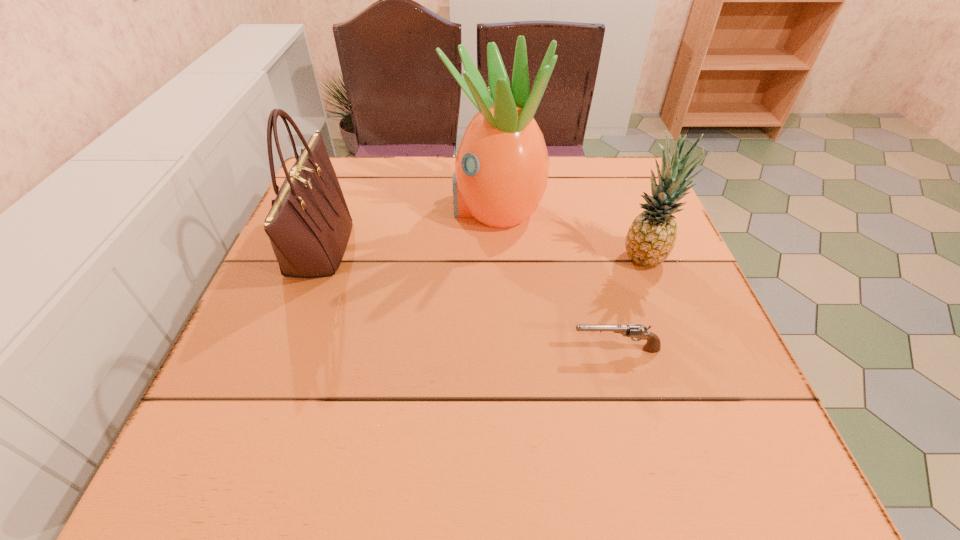
In the image, there is a desktop. Identify the location of vacant region at the far edge. (429, 160).

This screenshot has width=960, height=540. In the image, there is a desktop. In order to click on vacant space at the near edge in this screenshot , I will do `click(354, 474)`.

Locate an element on the screen. The width and height of the screenshot is (960, 540). vacant region at the left edge is located at coordinates (319, 292).

In the image, there is a desktop. What are the coordinates of `vacant space at the right edge` in the screenshot? It's located at (690, 376).

You are a GUI agent. You are given a task and a screenshot of the screen. Output one action in this format:
    pyautogui.click(x=<x>, y=<y>)
    Task: Click on the vacant point at the far left corner
    The height and width of the screenshot is (540, 960).
    Given the screenshot: What is the action you would take?
    pyautogui.click(x=331, y=158)

The image size is (960, 540). In the image, there is a desktop. What are the coordinates of `blank space at the far right corner` in the screenshot? It's located at (605, 202).

The width and height of the screenshot is (960, 540). I want to click on vacant space at the near right corner of the desktop, so pyautogui.click(x=764, y=451).

Find the location of a particular element. The image size is (960, 540). vacant space that's between the leftmost object and the shorter pineapple is located at coordinates (482, 252).

Where is `vacant area between the left pineapple and the right pineapple`? The image size is (960, 540). vacant area between the left pineapple and the right pineapple is located at coordinates (570, 233).

At what (x,y) coordinates should I click in order to perform the action: click on unoccupied position between the handbag and the right pineapple. Please return your answer as a coordinate pair (x, y). Looking at the image, I should click on (482, 252).